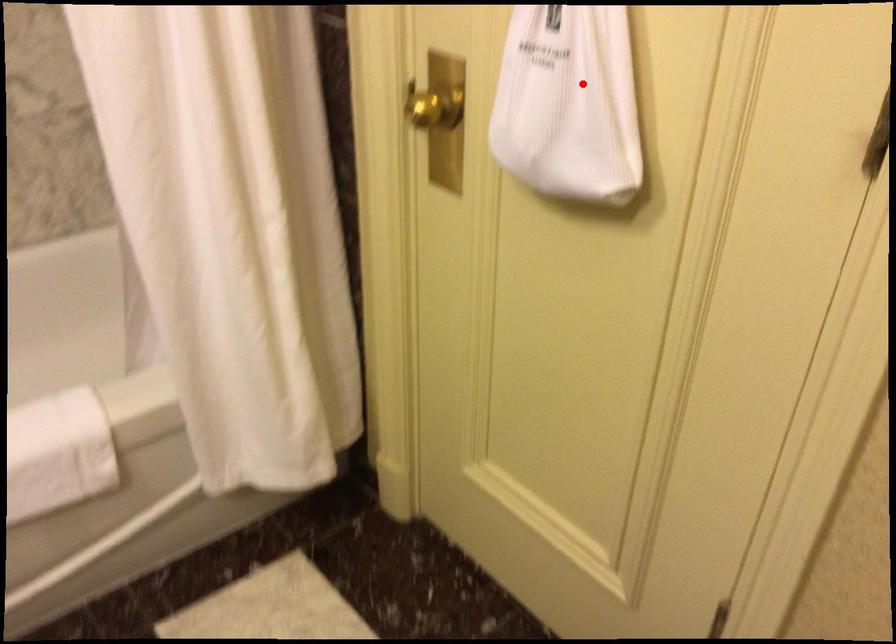
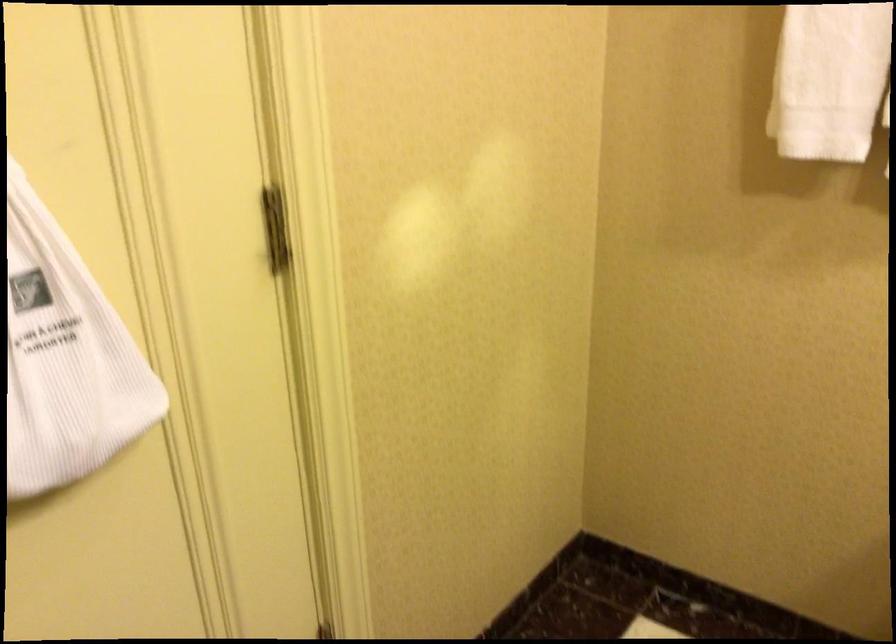
Question: I am providing you with two images of the same scene from different viewpoints. Given a red point in image1, look at the same physical point in image2. Is it:

Choices:
 (A) Closer to the viewpoint
 (B) Farther from the viewpoint

Answer: (A)